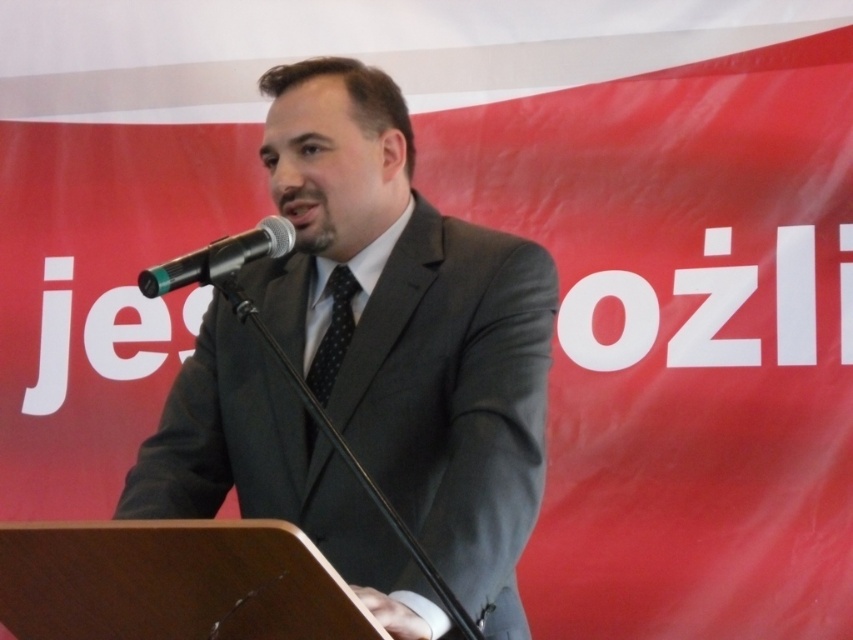
Question: Can you confirm if matte gray suit at center is smaller than black dotted tie at center?

Choices:
 (A) yes
 (B) no

Answer: (B)

Question: Which point is farther to the camera?

Choices:
 (A) matte gray suit at center
 (B) black dotted tie at center

Answer: (B)

Question: Is matte gray suit at center positioned in front of black dotted tie at center?

Choices:
 (A) yes
 (B) no

Answer: (A)

Question: Can you confirm if matte gray suit at center is smaller than black dotted tie at center?

Choices:
 (A) no
 (B) yes

Answer: (A)

Question: Which point is closer to the camera taking this photo?

Choices:
 (A) (141, 269)
 (B) (310, 372)
 (C) (527, 516)

Answer: (C)

Question: Estimate the real-world distances between objects in this image. Which object is closer to the black dotted tie at center?

Choices:
 (A) black metallic microphone at center
 (B) matte gray suit at center

Answer: (B)